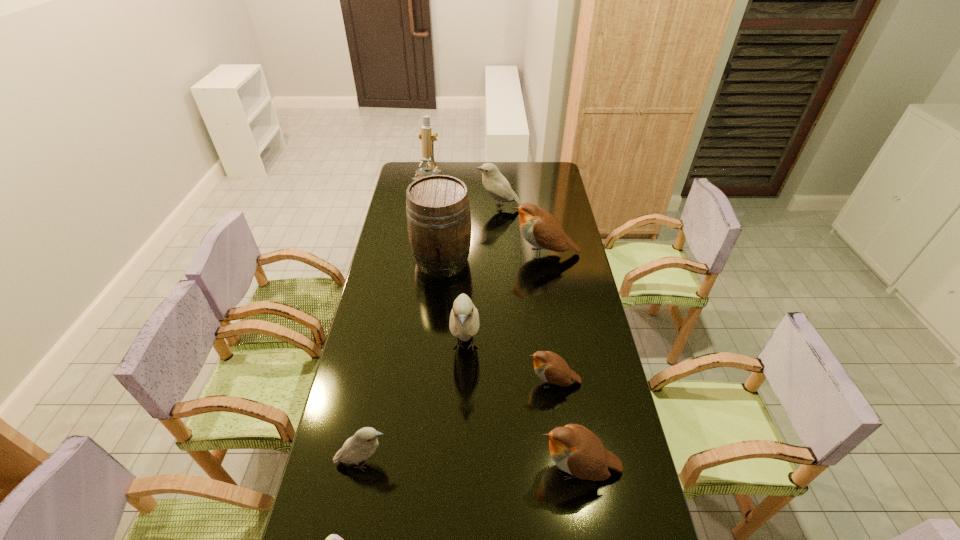
This screenshot has width=960, height=540. Find the location of `the nearest white bird`. the nearest white bird is located at coordinates (364, 443).

Identify the location of the eighth tallest object. (550, 367).

This screenshot has width=960, height=540. Identify the location of the shortest bird. (550, 367).

You are a GUI agent. You are given a task and a screenshot of the screen. Output one action in this format:
    pyautogui.click(x=<x>, y=<y>)
    Task: Click on the blank space located 0.060m on the left of the microscope
    
    Given the screenshot: What is the action you would take?
    pyautogui.click(x=402, y=195)

Locate an element on the screen. Image resolution: width=960 pixels, height=540 pixels. free space located on the side of the cider near the bung hole is located at coordinates (439, 292).

Where is `vacant area located at the beak of the biggest white bird`? The image size is (960, 540). vacant area located at the beak of the biggest white bird is located at coordinates (463, 431).

Image resolution: width=960 pixels, height=540 pixels. I want to click on free space located at the face of the farthest brown bird, so click(476, 254).

The height and width of the screenshot is (540, 960). What are the coordinates of `vacant space located 0.100m at the face of the farthest brown bird` in the screenshot? It's located at (488, 254).

At what (x,y) coordinates should I click in order to perform the action: click on vacant space located 0.310m at the face of the farthest brown bird. Please return your answer as a coordinate pair (x, y). This screenshot has width=960, height=540. Looking at the image, I should click on (439, 254).

Where is `free space located 0.160m at the beak of the farthest bird`? free space located 0.160m at the beak of the farthest bird is located at coordinates (444, 207).